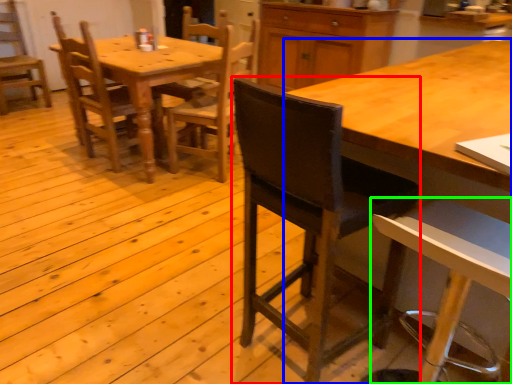
Question: Based on their relative distances, which object is farther from chair (highlighted by a red box)? Choose from desk (highlighted by a blue box) and chair (highlighted by a green box).

Choices:
 (A) desk
 (B) chair

Answer: (A)